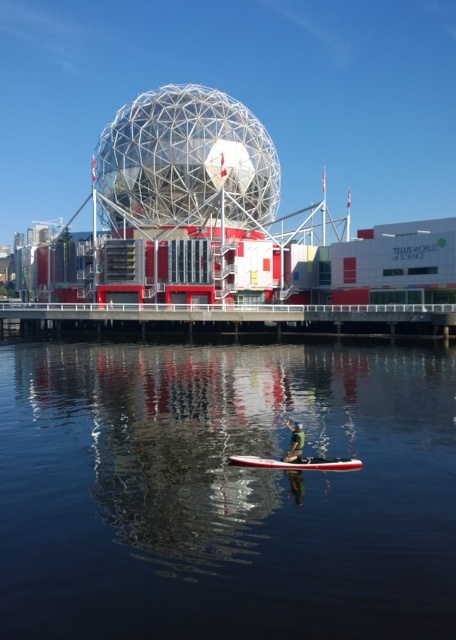
Question: Is transparent water at center to the left of white glossy canoe at center from the viewer's perspective?

Choices:
 (A) yes
 (B) no

Answer: (A)

Question: Which point is farther to the camera?

Choices:
 (A) white glossy canoe at center
 (B) transparent water at center
 (C) white glossy dock at center

Answer: (C)

Question: Does white glossy dock at center appear under green fabric at center?

Choices:
 (A) no
 (B) yes

Answer: (A)

Question: Is white glossy canoe at center positioned in front of green fabric at center?

Choices:
 (A) yes
 (B) no

Answer: (A)

Question: Which object appears farthest from the camera in this image?

Choices:
 (A) green fabric at center
 (B) transparent water at center

Answer: (A)

Question: Which object is the closest to the green fabric at center?

Choices:
 (A) transparent water at center
 (B) white glossy dock at center
 (C) white glossy canoe at center

Answer: (C)